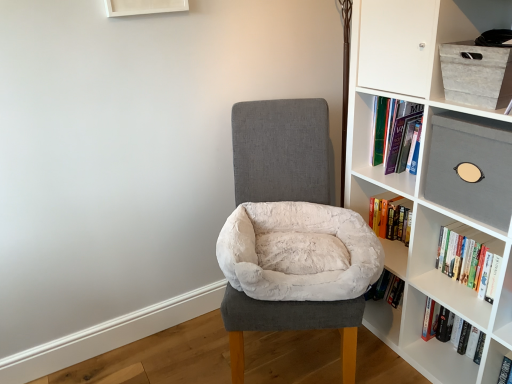
Question: Does hardcover book at right, which is the 1th book in bottom-to-top order, come behind white textured box at upper right?

Choices:
 (A) yes
 (B) no

Answer: (A)

Question: Can you confirm if hardcover book at right, the second book positioned from the top, is bigger than white textured box at upper right?

Choices:
 (A) yes
 (B) no

Answer: (A)

Question: Considering the relative sizes of hardcover book at right, the second book positioned from the top, and white textured box at upper right in the image provided, is hardcover book at right, the second book positioned from the top, thinner than white textured box at upper right?

Choices:
 (A) yes
 (B) no

Answer: (A)

Question: Considering the relative sizes of hardcover book at right, the second book positioned from the top, and white textured box at upper right in the image provided, is hardcover book at right, the second book positioned from the top, wider than white textured box at upper right?

Choices:
 (A) yes
 (B) no

Answer: (B)

Question: Is hardcover book at right, the second book positioned from the top, far away from white textured box at upper right?

Choices:
 (A) no
 (B) yes

Answer: (A)

Question: From the image's perspective, does hardcover book at right, which is the 1th book in bottom-to-top order, appear lower than white textured box at upper right?

Choices:
 (A) yes
 (B) no

Answer: (A)

Question: Does hardcover book at right, the 2th book from the bottom, have a larger size compared to white plush bean bag at center?

Choices:
 (A) no
 (B) yes

Answer: (A)

Question: Is hardcover book at right, the 2th book from the bottom, positioned with its back to white plush bean bag at center?

Choices:
 (A) yes
 (B) no

Answer: (B)

Question: Does hardcover book at right, the 2th book from the bottom, lie behind white plush bean bag at center?

Choices:
 (A) yes
 (B) no

Answer: (A)

Question: Is hardcover book at right, the 2th book from the bottom, surrounding white plush bean bag at center?

Choices:
 (A) yes
 (B) no

Answer: (B)

Question: Is hardcover book at right, arranged as the first book when viewed from the top, positioned far away from white plush bean bag at center?

Choices:
 (A) no
 (B) yes

Answer: (A)

Question: Does hardcover book at right, the 2th book from the bottom, turn towards white plush bean bag at center?

Choices:
 (A) yes
 (B) no

Answer: (A)

Question: Can you confirm if white plush bean bag at center is wider than matte gray box at upper right?

Choices:
 (A) yes
 (B) no

Answer: (A)